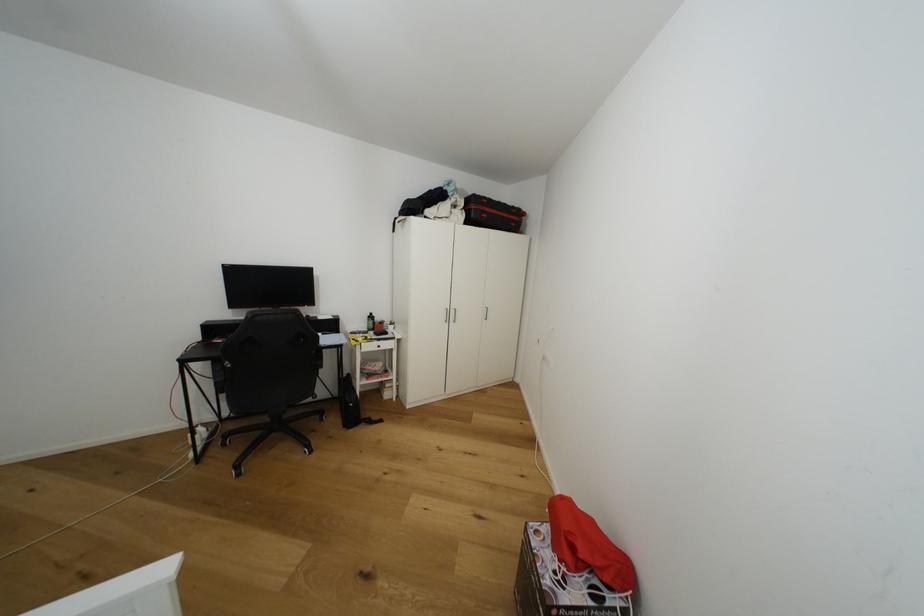
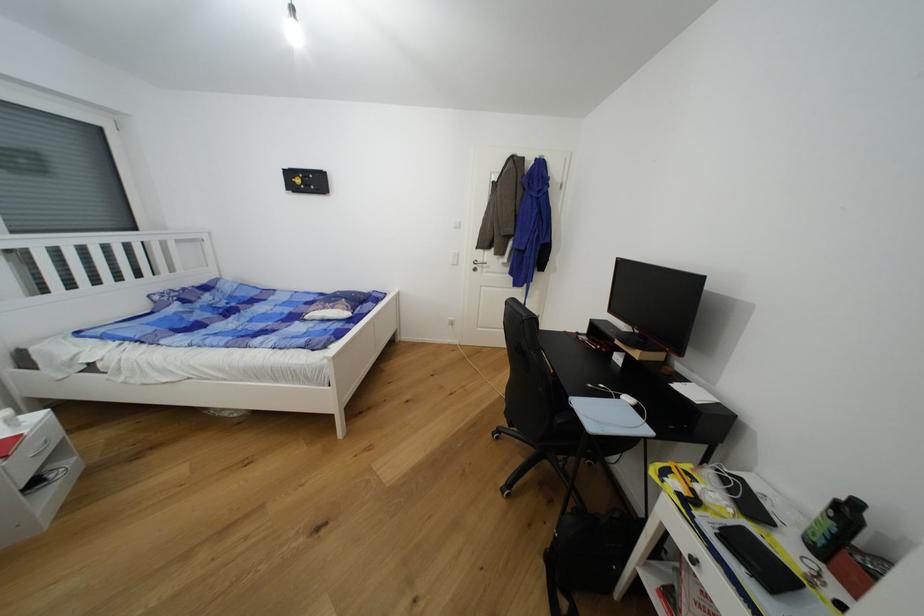
In the second image, find the point that corresponds to point (377, 315) in the first image.

(862, 506)